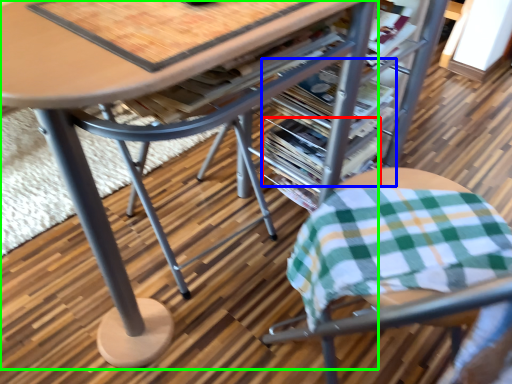
Question: Considering the real-world distances, which object is closest to magazine (highlighted by a red box)? magazine (highlighted by a blue box) or table (highlighted by a green box).

Choices:
 (A) magazine
 (B) table

Answer: (A)